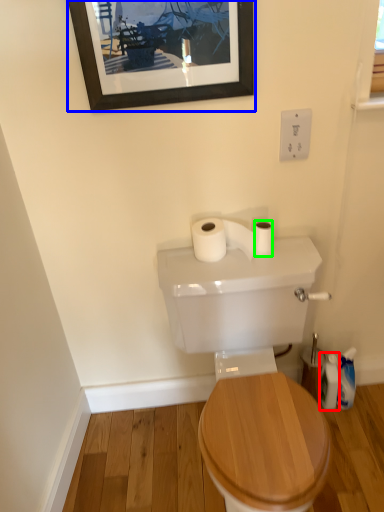
Question: Based on their relative distances, which object is nearer to toiletry (highlighted by a red box)? Choose from picture frame (highlighted by a blue box) and toilet paper (highlighted by a green box).

Choices:
 (A) picture frame
 (B) toilet paper

Answer: (B)